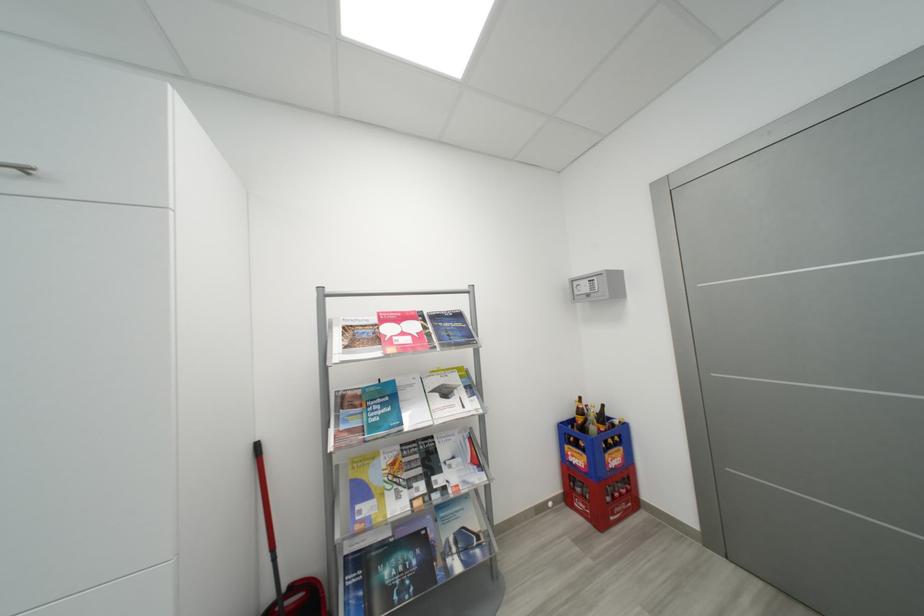
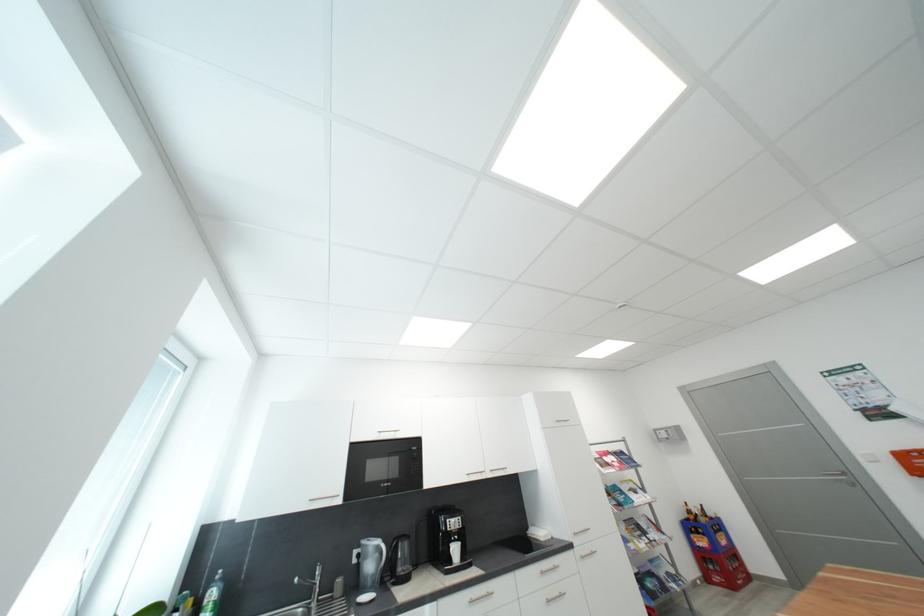
Where in the second image is the point corresponding to (600,430) from the first image?

(710, 522)